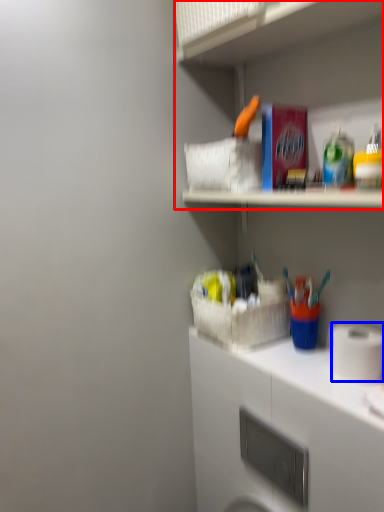
Question: Which object is closer to the camera taking this photo, shelf (highlighted by a red box) or toilet paper (highlighted by a blue box)?

Choices:
 (A) shelf
 (B) toilet paper

Answer: (A)